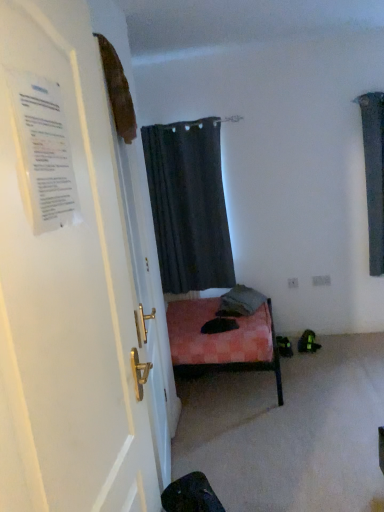
Question: Can you see white glossy door at left touching dark gray fabric curtain at upper center?

Choices:
 (A) no
 (B) yes

Answer: (A)

Question: Is white glossy door at left bigger than dark gray fabric curtain at upper center?

Choices:
 (A) no
 (B) yes

Answer: (A)

Question: Is white glossy door at left smaller than dark gray fabric curtain at upper center?

Choices:
 (A) yes
 (B) no

Answer: (A)

Question: Is white glossy door at left at the left side of dark gray fabric curtain at upper center?

Choices:
 (A) no
 (B) yes

Answer: (B)

Question: From the image's perspective, would you say white glossy door at left is shown under dark gray fabric curtain at upper center?

Choices:
 (A) no
 (B) yes

Answer: (B)

Question: Considering the positions of point (61, 114) and point (89, 193), is point (61, 114) closer or farther from the camera than point (89, 193)?

Choices:
 (A) closer
 (B) farther

Answer: (A)

Question: In terms of height, does white paper at left look taller or shorter compared to white glossy door at left?

Choices:
 (A) tall
 (B) short

Answer: (B)

Question: From the image's perspective, is white paper at left positioned above or below white glossy door at left?

Choices:
 (A) above
 (B) below

Answer: (A)

Question: Is white paper at left inside the boundaries of white glossy door at left, or outside?

Choices:
 (A) inside
 (B) outside

Answer: (A)

Question: In terms of size, does dark gray fabric curtain at upper center appear bigger or smaller than white glossy door at left?

Choices:
 (A) big
 (B) small

Answer: (A)

Question: Is dark gray fabric curtain at upper center to the left or to the right of white glossy door at left in the image?

Choices:
 (A) left
 (B) right

Answer: (B)

Question: Is dark gray fabric curtain at upper center taller or shorter than white glossy door at left?

Choices:
 (A) short
 (B) tall

Answer: (A)

Question: Is dark gray fabric curtain at upper center wider or thinner than white glossy door at left?

Choices:
 (A) thin
 (B) wide

Answer: (B)

Question: Considering the positions of dark gray fabric curtain at upper center and white paper at left in the image, is dark gray fabric curtain at upper center taller or shorter than white paper at left?

Choices:
 (A) short
 (B) tall

Answer: (B)

Question: Do you think dark gray fabric curtain at upper center is within white paper at left, or outside of it?

Choices:
 (A) inside
 (B) outside

Answer: (B)